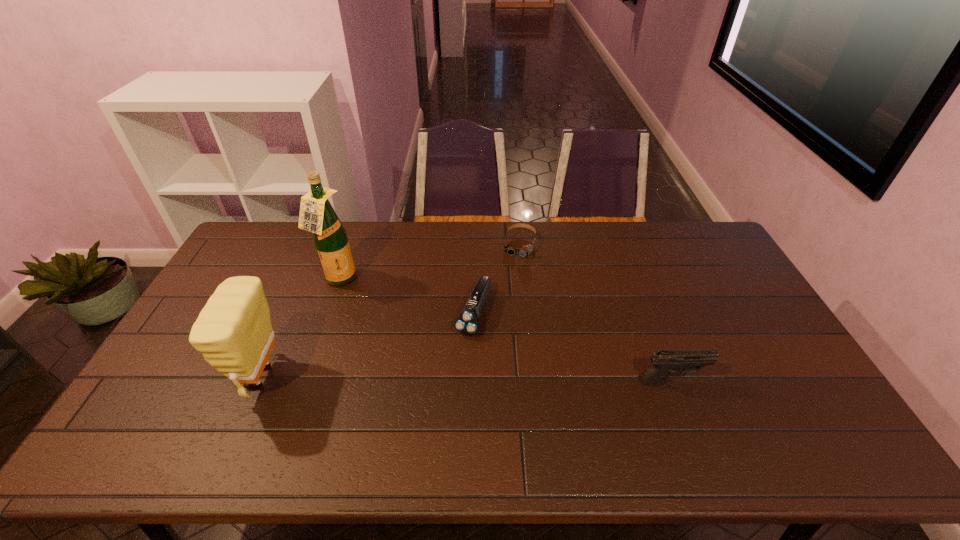
Locate an element on the screen. This screenshot has width=960, height=540. free location that satisfies the following two spatial constraints: 1. on the front side of the tallest object; 2. on the left side of the third object from right to left is located at coordinates (326, 313).

What are the coordinates of `vacant region that satisfies the following two spatial constraints: 1. on the front side of the electric shaver; 2. at the barrel of the rightmost object` in the screenshot? It's located at (472, 381).